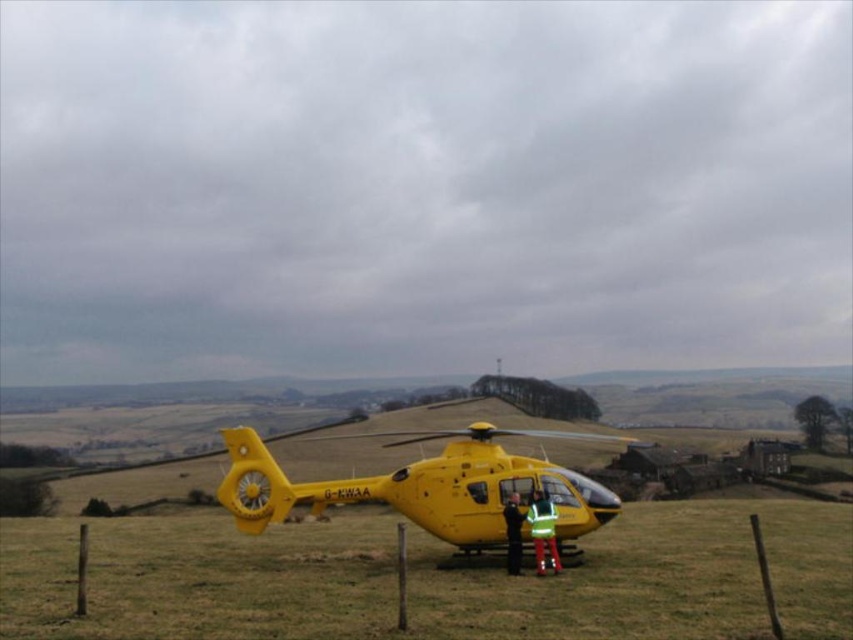
You are a drone operator who needs to land your drone safely. The yellow matte helicopter at center is located at coordinates point 0.906, 0.505. Where should you direct your drone to land?

The yellow matte helicopter at center is located at point (430,579), so you should direct your drone to land away from this point to avoid collision with the helicopter.

You are a drone operator planning to fly a drone over the grassy field where the yellow helicopter is parked. You need to avoid two specific points marked as point 1 at coordinates point (747, 513) and point 2 at coordinates point (517, 486). If you are flying towards the helicopter from the direction of the farmhouse in the background, which point should you avoid first?

Point 2 at coordinates point (517, 486) should be avoided first because point 1 at coordinates point (747, 513) is behind point 2, meaning point 2 is closer to your flight path when approaching from the farmhouse direction.